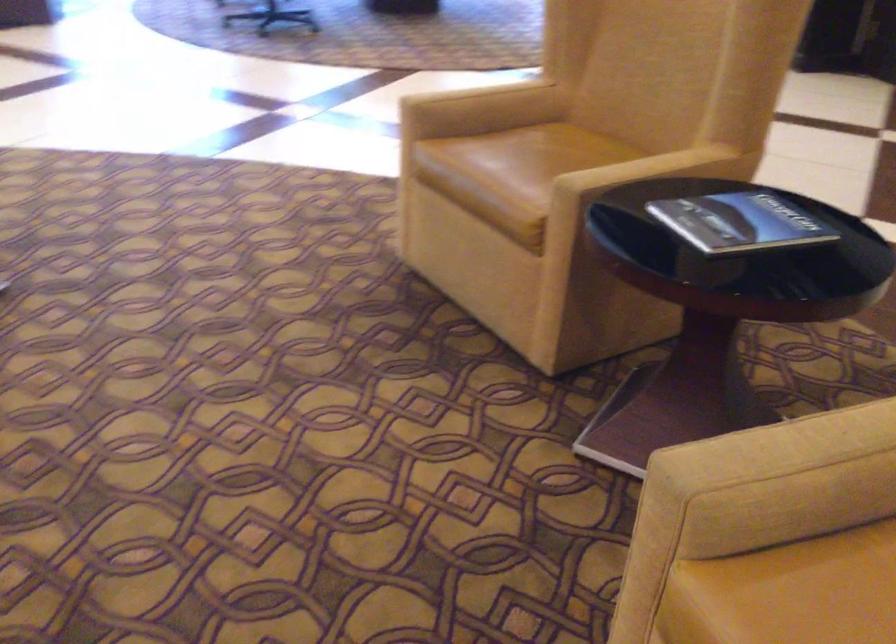
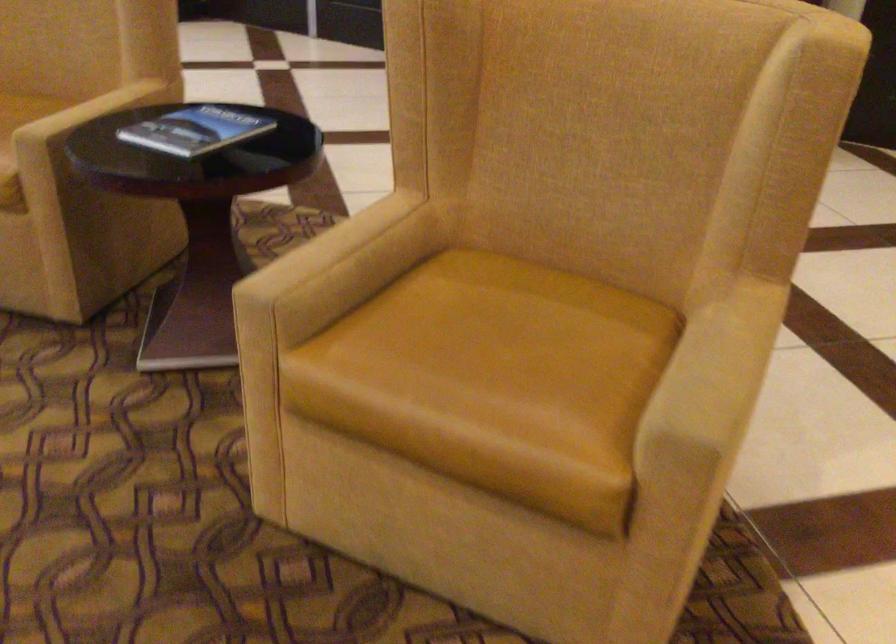
Question: Based on the continuous images, in which direction is the camera rotating? Reply with the corresponding letter.

Choices:
 (A) Left
 (B) Right
 (C) Up
 (D) Down

Answer: (B)